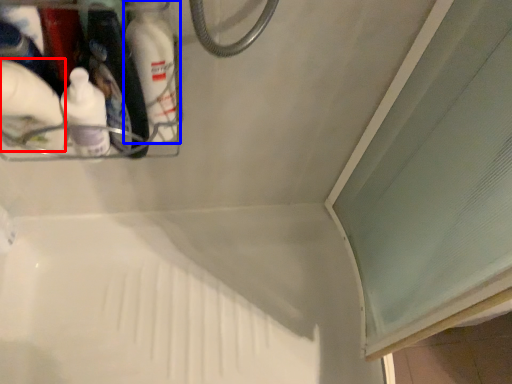
Question: Which object appears farthest to the camera in this image, cleaning product (highlighted by a red box) or bottle (highlighted by a blue box)?

Choices:
 (A) cleaning product
 (B) bottle

Answer: (B)